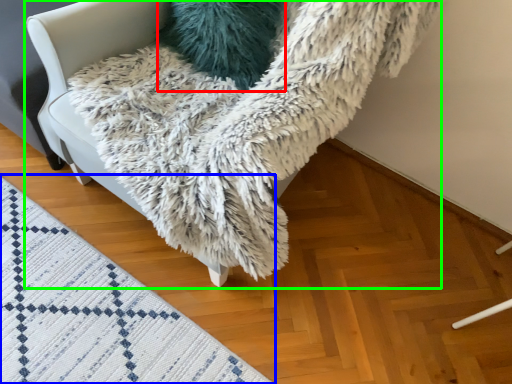
Question: Which object is the closest to the pillow (highlighted by a red box)? Choose among these: mat (highlighted by a blue box) or furniture (highlighted by a green box).

Choices:
 (A) mat
 (B) furniture

Answer: (B)